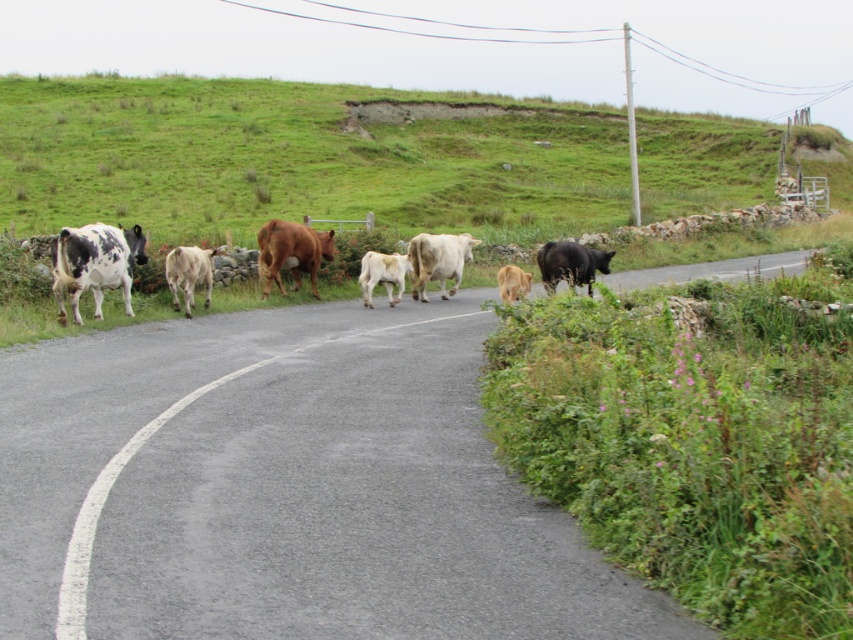
Looking at this image, you are a photographer standing at the side of the road. You want to take a photo that includes both the green grassy hillside at upper left and the white smooth cow at center. Which object will appear larger in the photo?

The green grassy hillside at upper left will appear larger in the photo because it is taller than the white smooth cow at center.

You are standing at the starting point of the road and want to reach the white smooth cow at center. What is the shortest path to reach it?

The shortest path to reach the white smooth cow at center would be to move directly towards its coordinates at point (438, 260), avoiding any obstacles like the stone wall on the left and staying on the road.